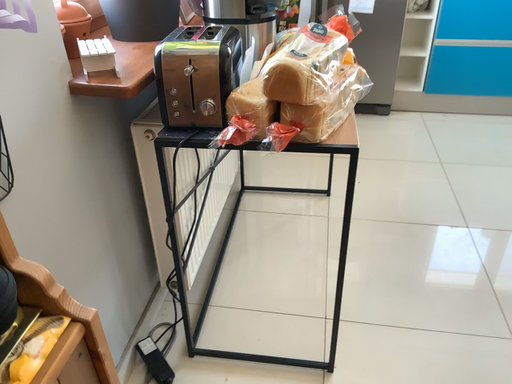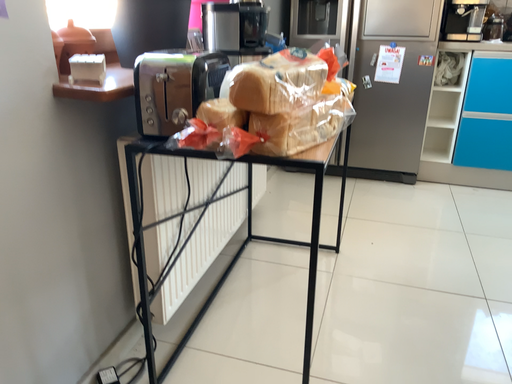
Question: How did the camera likely rotate when shooting the video?

Choices:
 (A) rotated downward
 (B) rotated upward

Answer: (B)